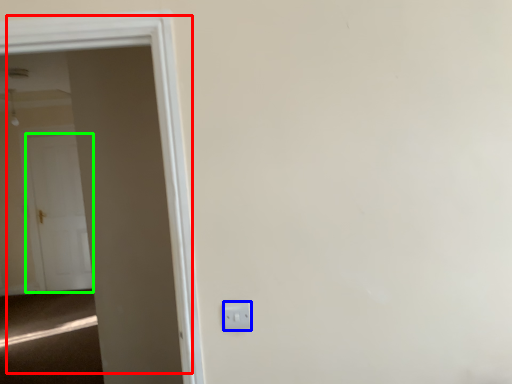
Question: Which is farther away from door (highlighted by a red box)? electric outlet (highlighted by a blue box) or door (highlighted by a green box)?

Choices:
 (A) electric outlet
 (B) door

Answer: (B)